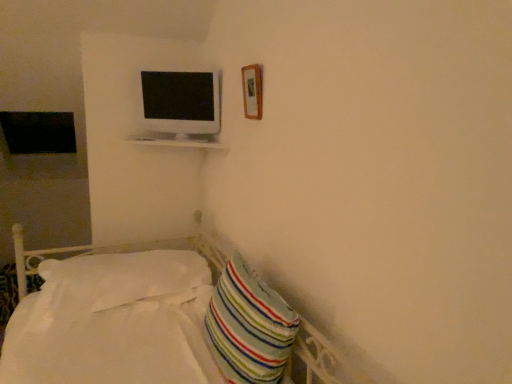
Question: From the image's perspective, would you say wooden frame at upper right is positioned over white glossy monitor at upper center?

Choices:
 (A) no
 (B) yes

Answer: (A)

Question: From a real-world perspective, is wooden frame at upper right under white glossy monitor at upper center?

Choices:
 (A) no
 (B) yes

Answer: (A)

Question: Considering the relative sizes of wooden frame at upper right and white glossy monitor at upper center in the image provided, is wooden frame at upper right shorter than white glossy monitor at upper center?

Choices:
 (A) yes
 (B) no

Answer: (A)

Question: Are wooden frame at upper right and white glossy monitor at upper center located far from each other?

Choices:
 (A) yes
 (B) no

Answer: (B)

Question: Is the position of wooden frame at upper right less distant than that of white glossy monitor at upper center?

Choices:
 (A) yes
 (B) no

Answer: (A)

Question: From the image's perspective, would you say wooden frame at upper right is shown under white glossy monitor at upper center?

Choices:
 (A) yes
 (B) no

Answer: (A)

Question: Is striped fabric pillow at lower right, which is the first pillow in right-to-left order, outside white soft pillow at lower left, placed as the first pillow when sorted from left to right?

Choices:
 (A) yes
 (B) no

Answer: (A)

Question: Is striped fabric pillow at lower right, which is the first pillow in right-to-left order, bigger than white soft pillow at lower left, positioned as the second pillow in front-to-back order?

Choices:
 (A) no
 (B) yes

Answer: (A)

Question: Is striped fabric pillow at lower right, marked as the second pillow in a left-to-right arrangement, thinner than white soft pillow at lower left, the second pillow when ordered from right to left?

Choices:
 (A) no
 (B) yes

Answer: (B)

Question: Considering the relative sizes of striped fabric pillow at lower right, which is the first pillow in right-to-left order, and white soft pillow at lower left, positioned as the second pillow in front-to-back order, in the image provided, is striped fabric pillow at lower right, which is the first pillow in right-to-left order, wider than white soft pillow at lower left, positioned as the second pillow in front-to-back order,?

Choices:
 (A) no
 (B) yes

Answer: (A)

Question: Considering the relative positions of striped fabric pillow at lower right, which is the first pillow in right-to-left order, and white soft pillow at lower left, positioned as the second pillow in front-to-back order, in the image provided, is striped fabric pillow at lower right, which is the first pillow in right-to-left order, to the right of white soft pillow at lower left, positioned as the second pillow in front-to-back order, from the viewer's perspective?

Choices:
 (A) no
 (B) yes

Answer: (B)

Question: Could you tell me if striped fabric pillow at lower right, which is the first pillow in right-to-left order, is turned towards white soft pillow at lower left, the second pillow when ordered from right to left?

Choices:
 (A) no
 (B) yes

Answer: (A)

Question: From a real-world perspective, is wooden frame at upper right on top of striped fabric pillow at lower right, the second pillow when ordered from back to front?

Choices:
 (A) no
 (B) yes

Answer: (B)